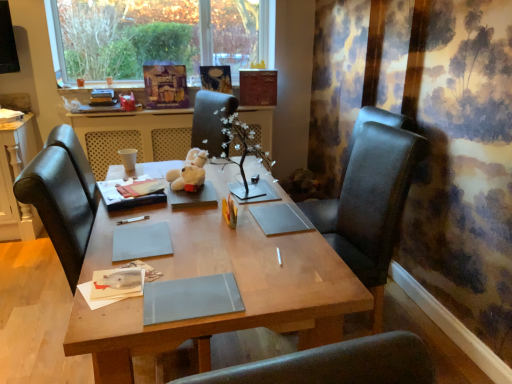
Find the location of a particular element. free space behind gray matte notebook at center, the 1th notebook when ordered from left to right is located at coordinates point(152,213).